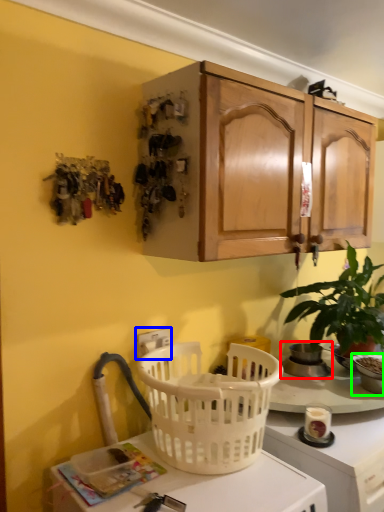
Question: Which object is the farthest from appliance (highlighted by a red box)? Choose among these: electric outlet (highlighted by a blue box) or appliance (highlighted by a green box).

Choices:
 (A) electric outlet
 (B) appliance

Answer: (A)